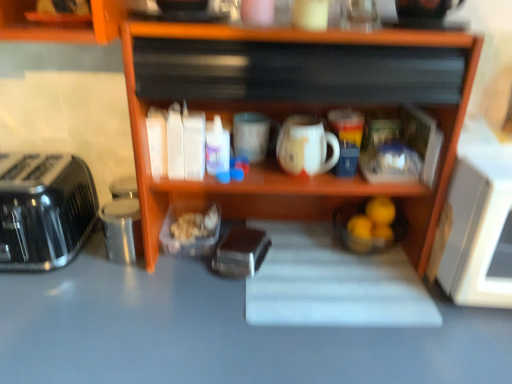
I want to click on free space to the left of metallic silver toaster at center, so click(162, 283).